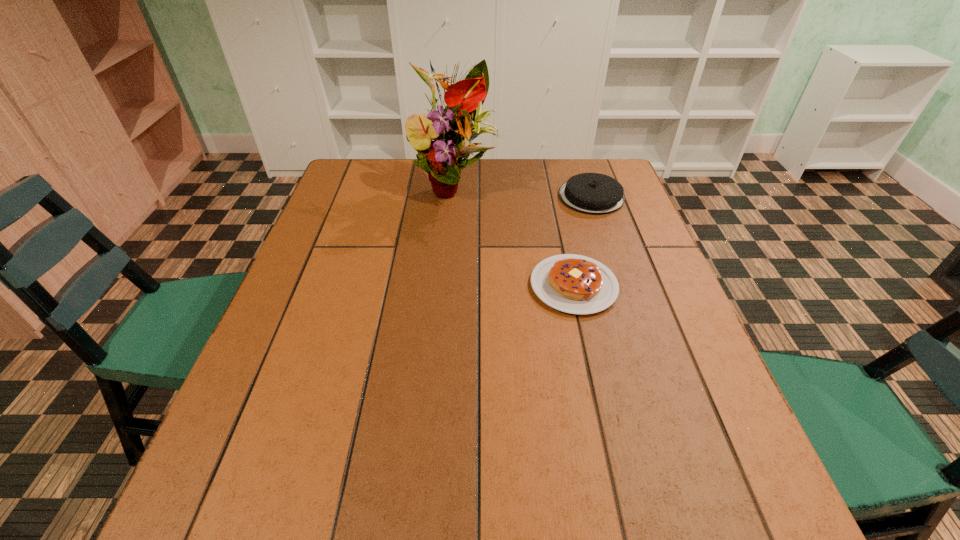
At what (x,y) coordinates should I click in order to perform the action: click on free space that satisfies the following two spatial constraints: 1. on the front-facing side of the farther pancake; 2. on the right side of the tallest object. Please return your answer as a coordinate pair (x, y). The width and height of the screenshot is (960, 540). Looking at the image, I should click on (454, 197).

This screenshot has width=960, height=540. Identify the location of free space that satisfies the following two spatial constraints: 1. on the front-facing side of the taller pancake; 2. on the left side of the bouquet. (454, 197).

At what (x,y) coordinates should I click in order to perform the action: click on blank area in the image that satisfies the following two spatial constraints: 1. on the front-facing side of the farther pancake; 2. on the right side of the tallest object. Please return your answer as a coordinate pair (x, y). Looking at the image, I should click on (454, 197).